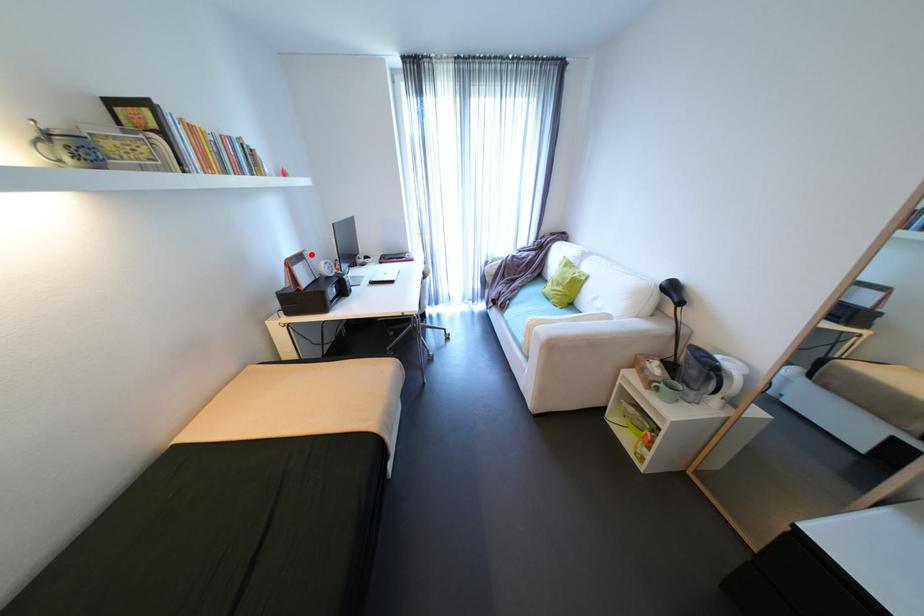
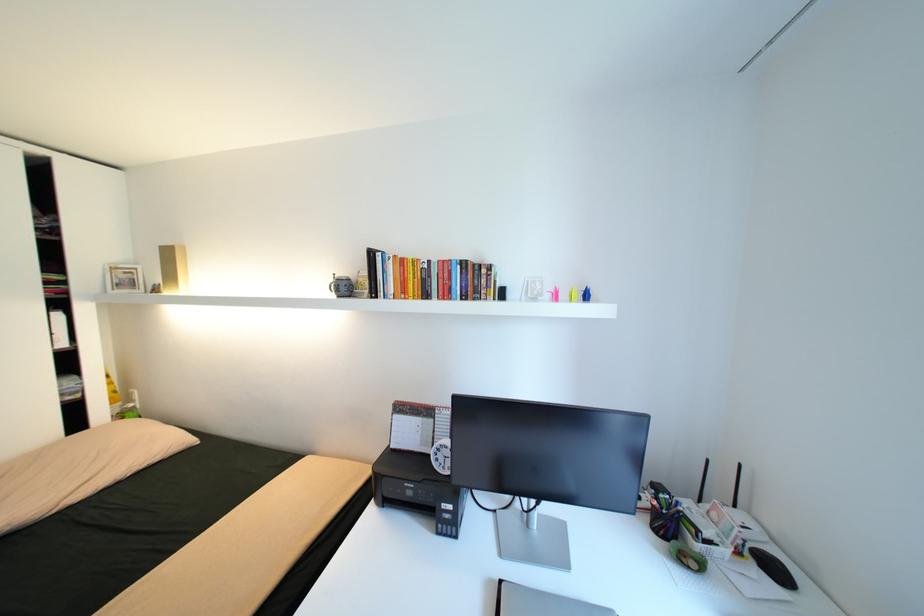
Where in the second image is the point corresponding to the highlighted location from the first image?

(444, 411)